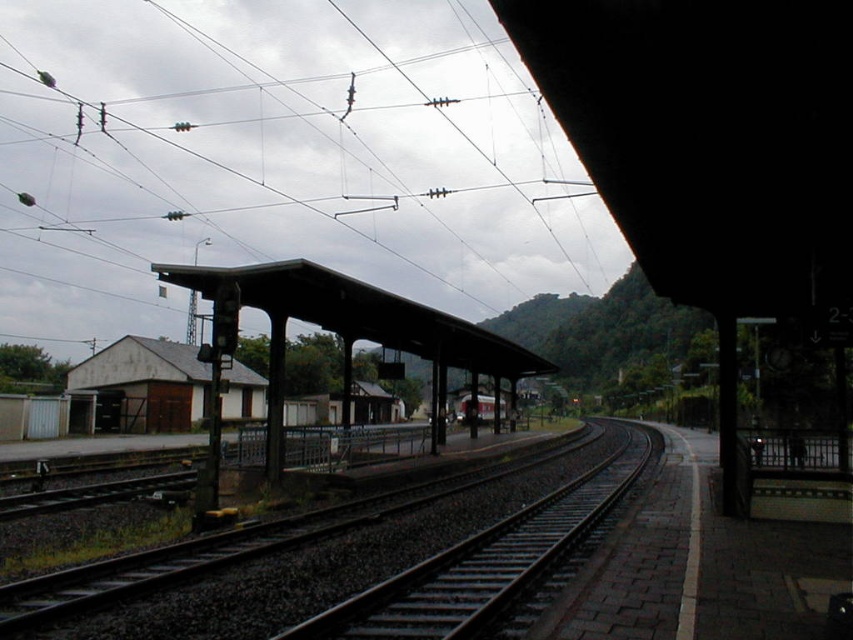
You are a passenger waiting at the station and want to board the red painted metal train at center. As you look up, you notice metallic wires at upper center. In which direction relative to the train are the wires located?

The metallic wires at upper center are located to the left of the red painted metal train at center.

Looking at this image, you are a maintenance worker who needs to inspect the metallic wires at upper center and the smooth metal train track at center. Given that you can only walk 150 meters in one inspection round, can you inspect both objects in a single round without exceeding your walking limit?

The distance between the metallic wires at upper center and the smooth metal train track at center is 147.39 meters. Since this is under the 150 meter limit, you can inspect both in a single round.

You are a maintenance worker inspecting the railway station. You notice the metallic wires at upper center and the smooth metal train track at center. Which object occupies a greater area in the image?

The metallic wires at upper center is larger in size than the smooth metal train track at center, so the metallic wires at upper center occupies a greater area in the image.